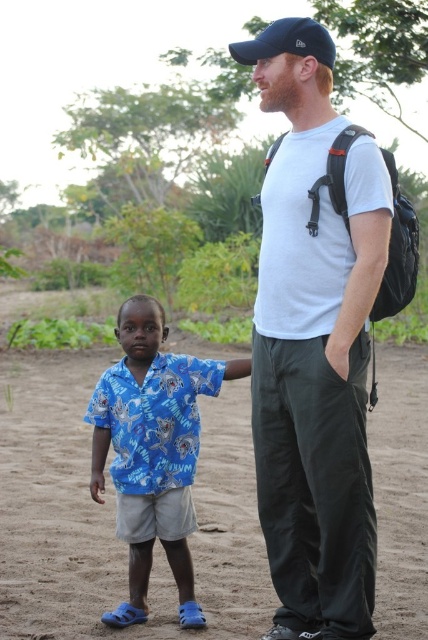
You are a photographer setting up a shot of the scene described. You want to ensure both the brown sandy dirt at lower left and the navy blue fabric baseball cap at upper center are clearly visible. Given their sizes, which object should you focus on first to ensure proper framing?

The brown sandy dirt at lower left is bigger than the navy blue fabric baseball cap at upper center, so you should focus on the brown sandy dirt at lower left first to ensure proper framing.